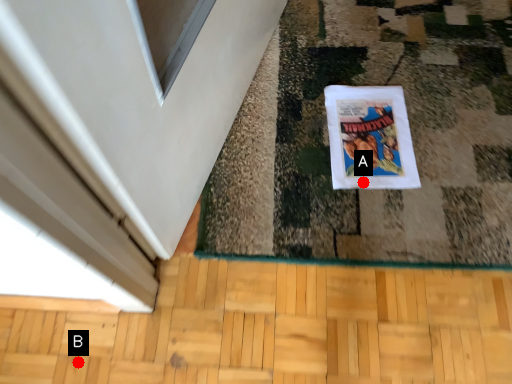
Question: Two points are circled on the image, labeled by A and B beside each circle. Which point is farther to the camera?

Choices:
 (A) A is further
 (B) B is further

Answer: (A)